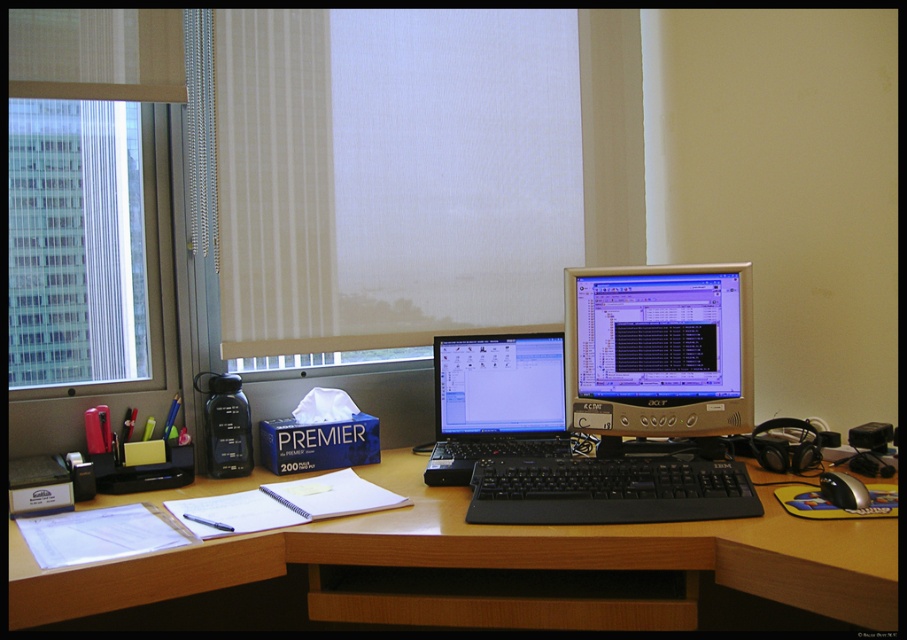
You are a remote worker who needs to reach the silver metallic mouse at lower right to adjust your screen brightness. However, there is a transparent glass window at left in your way. Can you move the mouse without touching the window?

The silver metallic mouse at lower right is behind the transparent glass window at left, so you can move the mouse without touching the window since it is positioned behind it.

You are setting up a new monitor stand in this workspace. The stand requires a minimum height difference of 10 cm between the transparent glass window at left and the silver metallic mouse at lower right. Based on the scene, can the stand be placed here?

The transparent glass window at left is taller than the silver metallic mouse at lower right, so the height difference meets the stand requirement.

You are setting up a presentation and need to ensure that the black plastic keyboard at center is fully visible. What should you do about the beige fabric curtain at upper center?

The beige fabric curtain at upper center is positioned over the black plastic keyboard at center, so you should move the beige fabric curtain at upper center to reveal the black plastic keyboard at center.